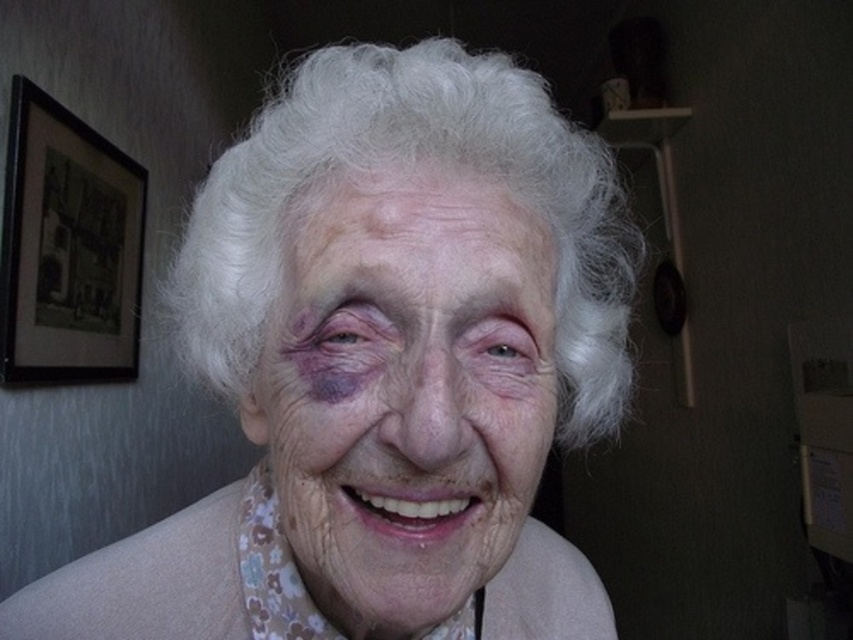
Who is taller, white textured hair at center or dry skin at center?

white textured hair at center is taller.

Does white textured hair at center have a lesser height compared to dry skin at center?

No, white textured hair at center is not shorter than dry skin at center.

Describe the element at coordinates (383, 365) in the screenshot. This screenshot has width=853, height=640. I see `white textured hair at center` at that location.

At what (x,y) coordinates should I click in order to perform the action: click on white textured hair at center. Please return your answer as a coordinate pair (x, y). The width and height of the screenshot is (853, 640). Looking at the image, I should click on (383, 365).

Can you confirm if white textured hair at center is thinner than black matte picture frame at upper left?

In fact, white textured hair at center might be wider than black matte picture frame at upper left.

Which of these two, white textured hair at center or black matte picture frame at upper left, stands taller?

black matte picture frame at upper left

Is point (224, 195) positioned in front of point (70, 316)?

That is True.

This screenshot has height=640, width=853. What are the coordinates of `white textured hair at center` in the screenshot? It's located at (383, 365).

Does smooth skin face at center have a lesser width compared to dry skin at center?

No.

Is point (335, 216) positioned behind point (450, 193)?

Yes, point (335, 216) is farther from viewer.

Find the location of a particular element. smooth skin face at center is located at coordinates (405, 390).